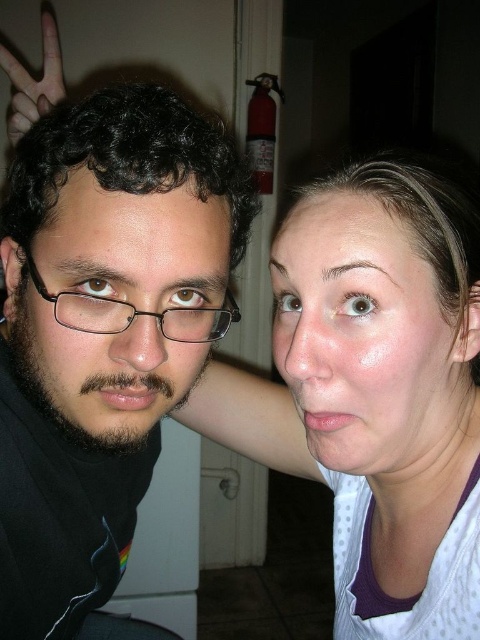
Question: Does black matte glasses at left have a greater width compared to matte black face at left?

Choices:
 (A) no
 (B) yes

Answer: (B)

Question: Considering the relative positions of black matte glasses at left and matte white shirt at center in the image provided, where is black matte glasses at left located with respect to matte white shirt at center?

Choices:
 (A) above
 (B) below

Answer: (B)

Question: Which point is closer to the camera taking this photo?

Choices:
 (A) (184, 276)
 (B) (467, 435)
 (C) (29, 109)
 (D) (48, 284)

Answer: (A)

Question: Which point appears farthest from the camera in this image?

Choices:
 (A) (100, 236)
 (B) (309, 412)
 (C) (183, 336)
 (D) (400, 314)

Answer: (B)

Question: Which point is closer to the camera?

Choices:
 (A) smooth skin face at center
 (B) black fur hand at upper left
 (C) matte white shirt at center

Answer: (A)

Question: Can you confirm if smooth skin face at center is positioned to the right of black plastic glasses at left?

Choices:
 (A) yes
 (B) no

Answer: (A)